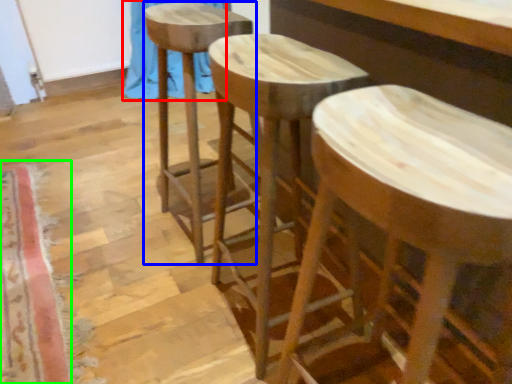
Question: Which object is the farthest from curtain (highlighted by a red box)? Choose among these: stool (highlighted by a blue box) or mat (highlighted by a green box).

Choices:
 (A) stool
 (B) mat

Answer: (B)